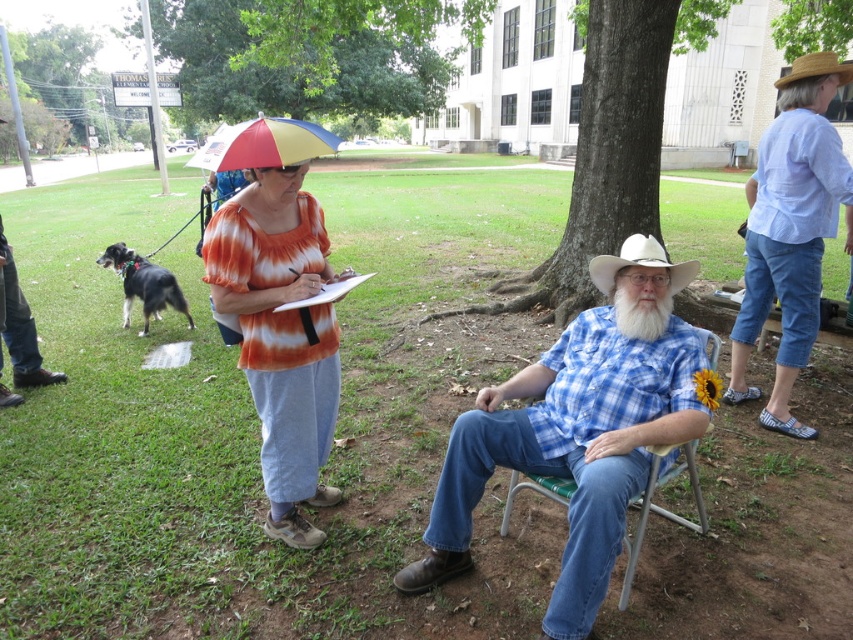
Question: Considering the relative positions of tie-dye fabric shirt at center and white felt cowboy hat at center in the image provided, where is tie-dye fabric shirt at center located with respect to white felt cowboy hat at center?

Choices:
 (A) right
 (B) left

Answer: (B)

Question: Can you confirm if tie-dye fabric shirt at center is positioned above white felt cowboy hat at center?

Choices:
 (A) no
 (B) yes

Answer: (A)

Question: Which point appears closest to the camera in this image?

Choices:
 (A) (267, 90)
 (B) (149, 269)
 (C) (677, 515)
 (D) (519, 291)

Answer: (C)

Question: Can you confirm if blue denim pants at right is bigger than black and white fur at left?

Choices:
 (A) yes
 (B) no

Answer: (A)

Question: Which object is positioned farthest from the blue denim pants at right?

Choices:
 (A) rainbow fabric umbrella at upper center
 (B) green leafy tree at upper center
 (C) strawhat at upper right

Answer: (B)

Question: Which object is farther from the camera taking this photo?

Choices:
 (A) green rough bark tree at center
 (B) tie-dye fabric shirt at center
 (C) green leafy tree at upper center

Answer: (C)